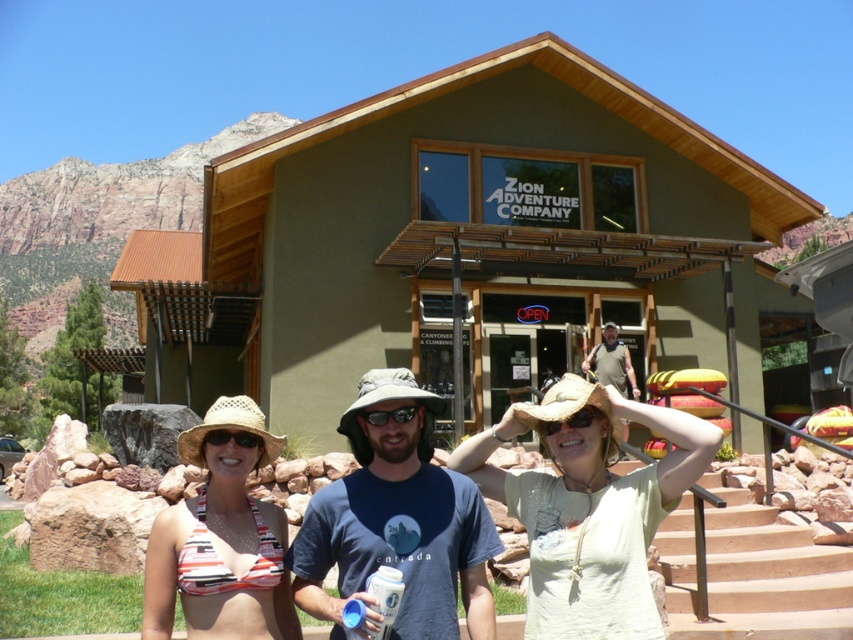
You are a photographer trying to capture a clear shot of both the light beige straw hat at center and the black plastic goggles at center. Since the camera can only focus on one object at a time, which object should you focus on to ensure the goggles are in the background?

You should focus on the light beige straw hat at center because it is closer to the viewer, making the black plastic goggles at center appear in the background.

You are a photographer trying to capture a clear shot of the transparent plastic goggles at center. However, the light beige straw hat at center is blocking your view. Can you adjust your angle to see the goggles without moving the hat?

The light beige straw hat at center is positioned under the transparent plastic goggles at center, so adjusting your angle downward might allow you to see the goggles above the hat.